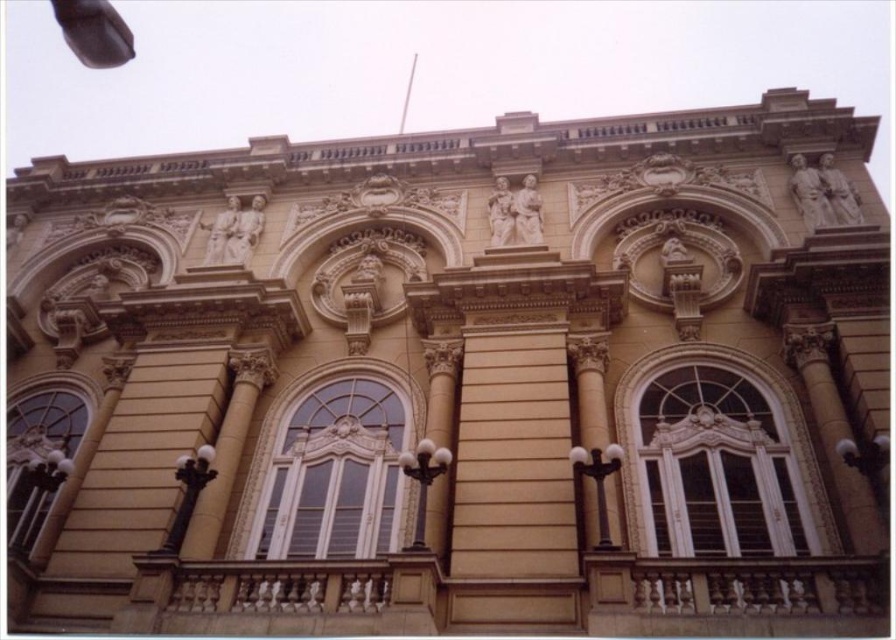
Question: Which of these objects is positioned closest to the white glossy window at center?

Choices:
 (A) golden stone column at center
 (B) brown stone column at center
 (C) white glass window at center

Answer: (B)

Question: Which point is farther from the camera taking this photo?

Choices:
 (A) (320, 387)
 (B) (587, 380)

Answer: (A)

Question: Which point is farther to the camera?

Choices:
 (A) (595, 480)
 (B) (277, 536)
 (C) (39, 486)
 (D) (747, 406)

Answer: (D)

Question: Is matte glass window at lower left to the left of golden stone column at center from the viewer's perspective?

Choices:
 (A) no
 (B) yes

Answer: (B)

Question: Does brown stone column at center appear under golden stone column at center?

Choices:
 (A) no
 (B) yes

Answer: (A)

Question: Is the position of white glossy window at center more distant than that of matte glass window at lower left?

Choices:
 (A) no
 (B) yes

Answer: (B)